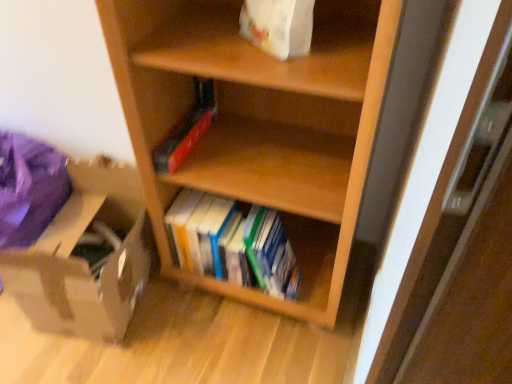
The height and width of the screenshot is (384, 512). What do you see at coordinates (260, 124) in the screenshot?
I see `wooden shelf at center` at bounding box center [260, 124].

At what (x,y) coordinates should I click in order to perform the action: click on brown cardboard box at lower left. Please return your answer as a coordinate pair (x, y). The height and width of the screenshot is (384, 512). Looking at the image, I should click on pyautogui.click(x=84, y=260).

Describe the element at coordinates (84, 260) in the screenshot. I see `brown cardboard box at lower left` at that location.

Identify the location of wooden shelf at center. (260, 124).

Based on the photo, which is behind, hardcover books at center or wooden shelf at center?

hardcover books at center is more distant.

Based on their sizes in the image, would you say hardcover books at center is bigger or smaller than wooden shelf at center?

In the image, hardcover books at center appears to be smaller than wooden shelf at center.

Measure the distance between hardcover books at center and wooden shelf at center.

hardcover books at center and wooden shelf at center are 21.88 centimeters apart from each other.

In the image, there is a hardcover books at center. At what (x,y) coordinates should I click in order to perform the action: click on shelf above it (from the image's perspective). Please return your answer as a coordinate pair (x, y). The image size is (512, 384). Looking at the image, I should click on (260, 124).

Considering the relative sizes of white paper bag at upper center and hardcover books at center in the image provided, is white paper bag at upper center smaller than hardcover books at center?

Correct, white paper bag at upper center occupies less space than hardcover books at center.

Measure the distance between white paper bag at upper center and hardcover books at center.

→ white paper bag at upper center is 24.14 inches away from hardcover books at center.

Is white paper bag at upper center oriented away from hardcover books at center?

No, white paper bag at upper center's orientation is not away from hardcover books at center.

Between white paper bag at upper center and hardcover books at center, which one is positioned in front?

white paper bag at upper center.

From a real-world perspective, who is located higher, brown cardboard box at lower left or wooden shelf at center?

wooden shelf at center, from a real-world perspective.

Which object is further away from the camera taking this photo, brown cardboard box at lower left or wooden shelf at center?

Positioned behind is brown cardboard box at lower left.

In terms of size, does brown cardboard box at lower left appear bigger or smaller than wooden shelf at center?

brown cardboard box at lower left is smaller than wooden shelf at center.

Is point (102, 194) closer or farther from the camera than point (331, 134)?

Point (102, 194) is positioned farther from the camera compared to point (331, 134).

What's the angular difference between wooden shelf at center and hardcover books at center's facing directions?

The facing directions of wooden shelf at center and hardcover books at center are 1.29 degrees apart.

Which is more to the left, wooden shelf at center or hardcover books at center?

Positioned to the left is hardcover books at center.

Considering the sizes of wooden shelf at center and hardcover books at center in the image, is wooden shelf at center wider or thinner than hardcover books at center?

Considering their sizes, wooden shelf at center looks broader than hardcover books at center.

Is wooden shelf at center completely or partially outside of hardcover books at center?

Yes, wooden shelf at center is outside of hardcover books at center.

Considering the relative sizes of hardcover books at center and white paper bag at upper center in the image provided, is hardcover books at center smaller than white paper bag at upper center?

Incorrect, hardcover books at center is not smaller in size than white paper bag at upper center.

Which is in front, hardcover books at center or white paper bag at upper center?

white paper bag at upper center is closer to the camera.

Between point (271, 264) and point (275, 0), which one is positioned in front?

The point (275, 0) is closer.

How different are the orientations of hardcover books at center and white paper bag at upper center in degrees?

There is a 33.4-degree angle between the facing directions of hardcover books at center and white paper bag at upper center.

Based on their sizes in the image, would you say brown cardboard box at lower left is bigger or smaller than hardcover books at center?

In the image, brown cardboard box at lower left appears to be larger than hardcover books at center.

Is hardcover books at center surrounded by brown cardboard box at lower left?

No, hardcover books at center is not inside brown cardboard box at lower left.

Can you confirm if brown cardboard box at lower left is positioned to the right of hardcover books at center?

No, brown cardboard box at lower left is not to the right of hardcover books at center.

From the image's perspective, which one is positioned lower, hardcover books at center or brown cardboard box at lower left?

From the image's view, brown cardboard box at lower left is below.

Is hardcover books at center in front of or behind brown cardboard box at lower left in the image?

Clearly, hardcover books at center is behind brown cardboard box at lower left.

Is hardcover books at center taller or shorter than brown cardboard box at lower left?

Considering their sizes, hardcover books at center has less height than brown cardboard box at lower left.

Which object is thinner, hardcover books at center or brown cardboard box at lower left?

hardcover books at center.

Locate an element on the screen. This screenshot has height=384, width=512. book that is on the left side of wooden shelf at center is located at coordinates (231, 242).

In order to click on paper bag in front of the hardcover books at center in this screenshot , I will do `click(278, 26)`.

When comparing their distances from brown cardboard box at lower left, does wooden shelf at center or hardcover books at center seem closer?

hardcover books at center.

From the image, which object appears to be nearer to wooden shelf at center, hardcover books at center or white paper bag at upper center?

hardcover books at center is closer to wooden shelf at center.

Based on their spatial positions, is brown cardboard box at lower left or white paper bag at upper center closer to wooden shelf at center?

Among the two, white paper bag at upper center is located nearer to wooden shelf at center.

From the image, which object appears to be farther from hardcover books at center, brown cardboard box at lower left or white paper bag at upper center?

white paper bag at upper center is further to hardcover books at center.

Consider the image. Which object lies further to the anchor point wooden shelf at center, brown cardboard box at lower left or hardcover books at center?

Among the two, brown cardboard box at lower left is located further to wooden shelf at center.

From the image, which object appears to be nearer to brown cardboard box at lower left, hardcover books at center or wooden shelf at center?

hardcover books at center lies closer to brown cardboard box at lower left than the other object.

Which object lies further to the anchor point brown cardboard box at lower left, white paper bag at upper center or wooden shelf at center?

white paper bag at upper center is positioned further to the anchor brown cardboard box at lower left.

Looking at this image, from the image, which object appears to be nearer to hardcover books at center, brown cardboard box at lower left or wooden shelf at center?

Based on the image, wooden shelf at center appears to be nearer to hardcover books at center.

Locate an element on the screen. The image size is (512, 384). book between brown cardboard box at lower left and wooden shelf at center in the horizontal direction is located at coordinates (231, 242).

The height and width of the screenshot is (384, 512). I want to click on shelf between white paper bag at upper center and hardcover books at center from top to bottom, so click(260, 124).

The image size is (512, 384). I want to click on shelf between white paper bag at upper center and brown cardboard box at lower left vertically, so click(x=260, y=124).

What are the coordinates of `book between white paper bag at upper center and brown cardboard box at lower left in the vertical direction` in the screenshot? It's located at (231, 242).